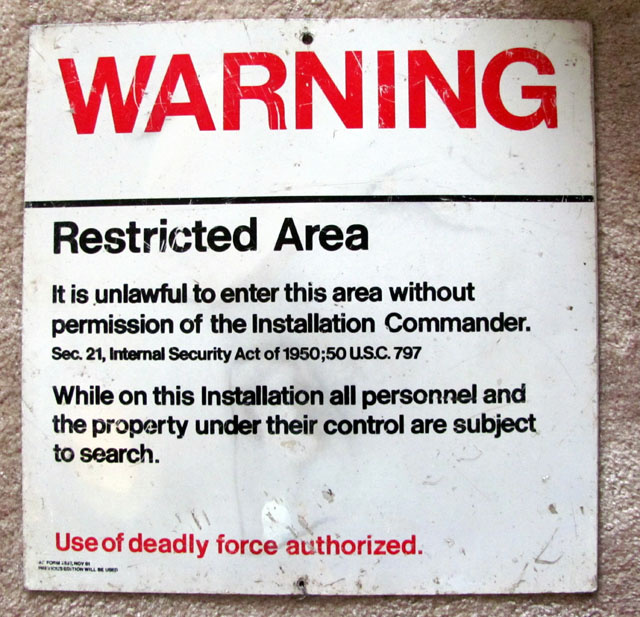
In order to click on carpet in this screenshot , I will do `click(618, 336)`.